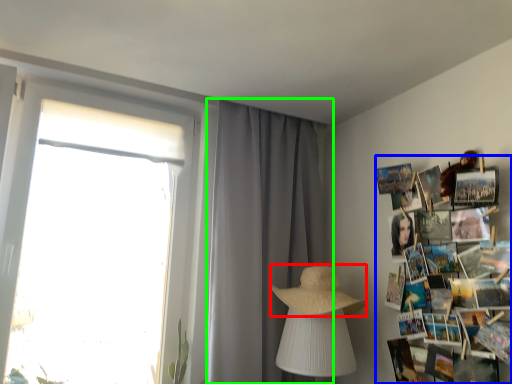
Question: Which object is positioned closest to straw hat (highlighted by a red box)? Select from magazine (highlighted by a blue box) and curtain (highlighted by a green box).

Choices:
 (A) magazine
 (B) curtain

Answer: (B)